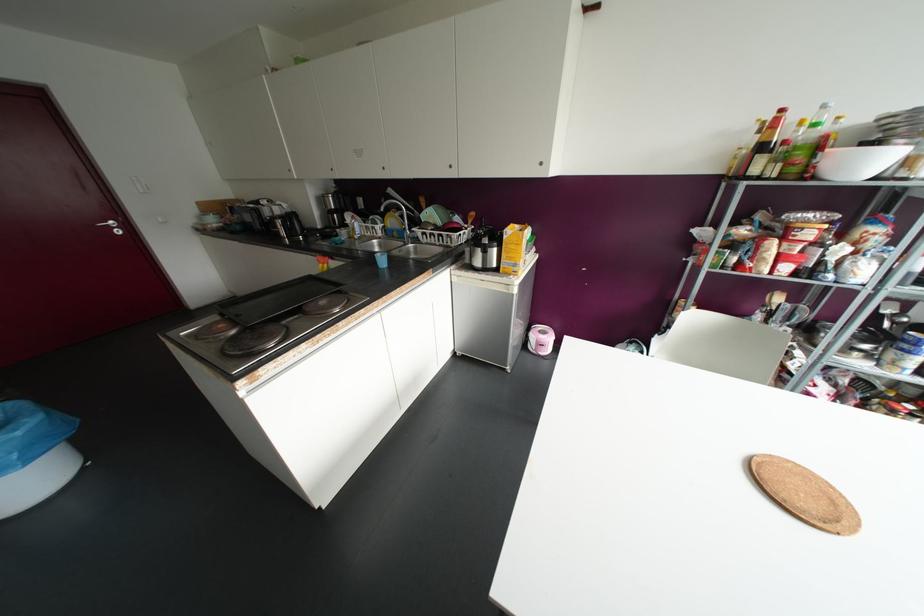
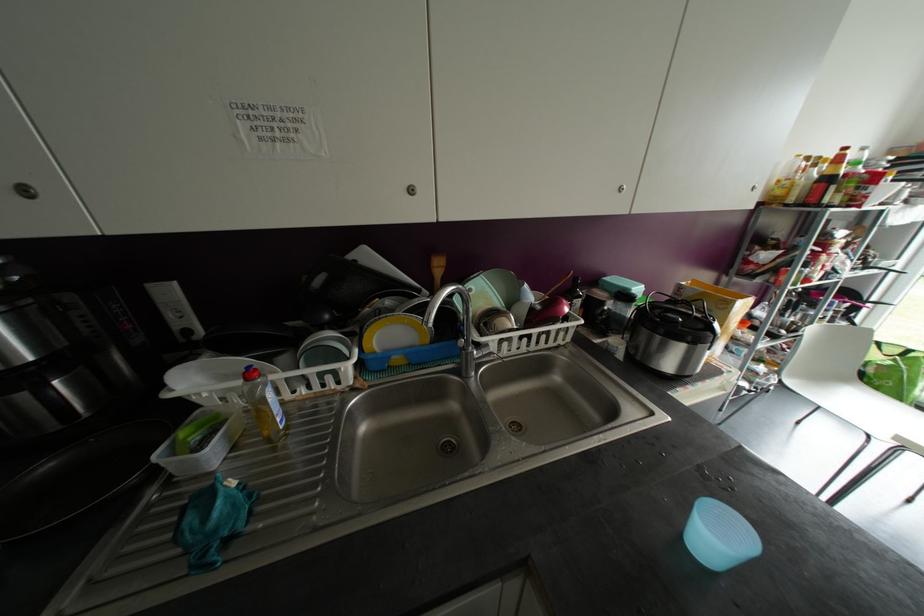
The point at (359, 238) is marked in the first image. Where is the corresponding point in the second image?

(286, 427)